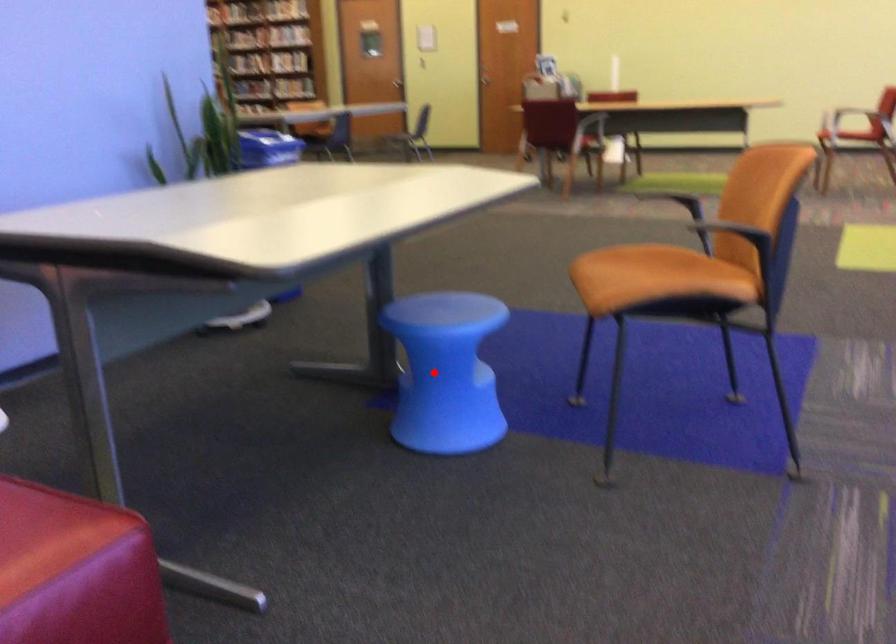
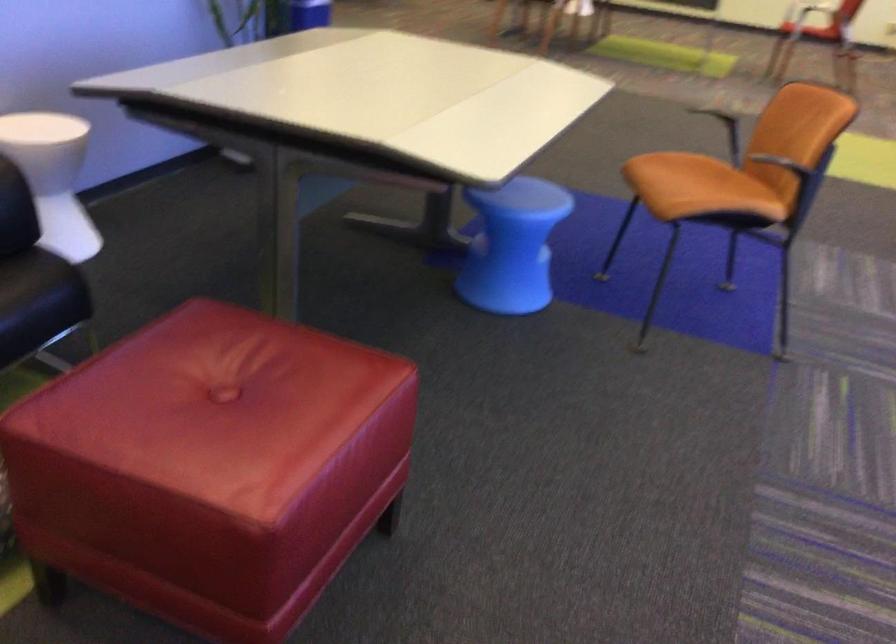
Question: I am providing you with two images of the same scene from different viewpoints. A red point is shown in image1. For the corresponding object point in image2, is it positioned nearer or farther from the camera?

Choices:
 (A) Nearer
 (B) Farther

Answer: (B)